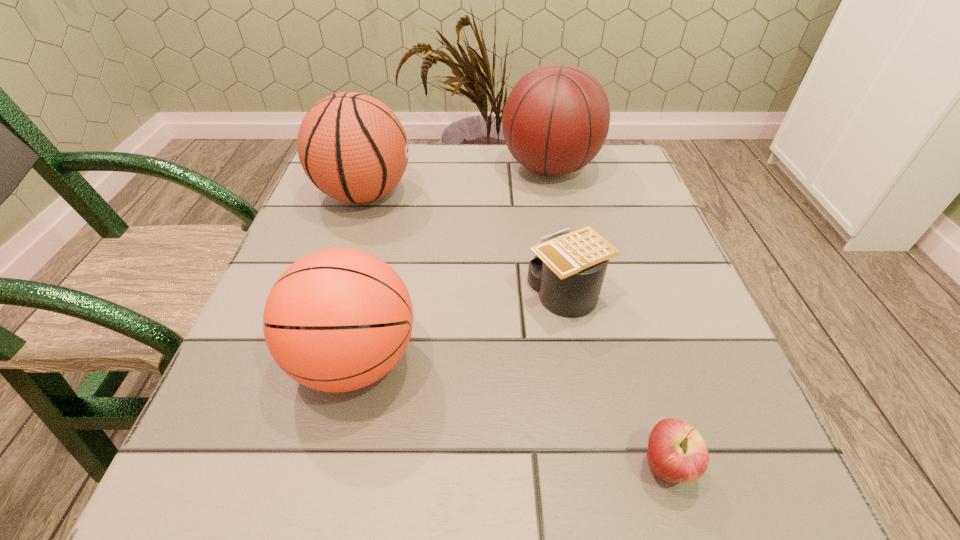
The height and width of the screenshot is (540, 960). What are the coordinates of `vacant space at the far right corner` in the screenshot? It's located at (603, 147).

Locate an element on the screen. This screenshot has width=960, height=540. blank space at the near right corner is located at coordinates (718, 463).

Find the location of `free space that is in between the nearest basketball and the rightmost basketball`. free space that is in between the nearest basketball and the rightmost basketball is located at coordinates (452, 264).

What are the coordinates of `free point between the calculator and the nearest basketball` in the screenshot? It's located at (461, 326).

At what (x,y) coordinates should I click in order to perform the action: click on vacant space in between the rightmost basketball and the nearest basketball. Please return your answer as a coordinate pair (x, y). This screenshot has width=960, height=540. Looking at the image, I should click on (452, 264).

Find the location of a particular element. The image size is (960, 540). blank region between the nearest object and the rightmost basketball is located at coordinates (608, 317).

The width and height of the screenshot is (960, 540). Identify the location of free space between the rightmost basketball and the apple. (608, 317).

Image resolution: width=960 pixels, height=540 pixels. I want to click on object that is the third closest one to the nearest object, so pos(556,119).

Image resolution: width=960 pixels, height=540 pixels. I want to click on object identified as the closest to the rightmost basketball, so click(x=352, y=147).

Image resolution: width=960 pixels, height=540 pixels. What are the coordinates of `the second closest basketball to the rightmost basketball` in the screenshot? It's located at (337, 320).